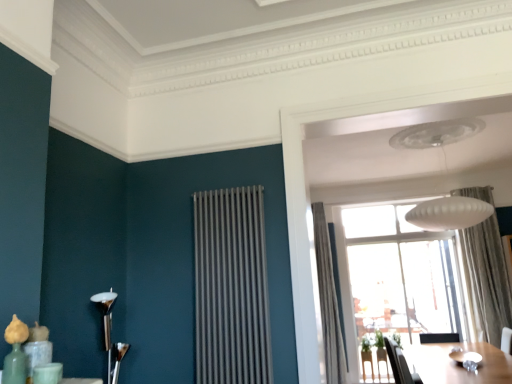
Question: Is polished silver candlestick at left, which ranks as the first lamp in front-to-back order, in front of or behind wooden table at lower right in the image?

Choices:
 (A) front
 (B) behind

Answer: (A)

Question: Does point (115, 372) appear closer or farther from the camera than point (489, 344)?

Choices:
 (A) farther
 (B) closer

Answer: (B)

Question: Which is farther from the transparent glass window at center?

Choices:
 (A) polished silver candlestick at left, marked as the 1th lamp in a left-to-right arrangement
 (B) black leather swivel chair at lower right
 (C) satin silver radiator at center
 (D) white textured curtain at upper right, the first curtain positioned from the right
 (E) white matte lampshade at upper center, the 1th lamp from the top

Answer: (A)

Question: Based on their relative distances, which object is nearer to the wooden table at lower right?

Choices:
 (A) transparent glass window at center
 (B) black leather swivel chair at lower right
 (C) gray textured curtain at upper right, positioned as the second curtain in right-to-left order
 (D) polished silver candlestick at left, which is the 2th lamp in top-to-bottom order
 (E) white textured curtain at upper right, arranged as the second curtain when viewed from the left

Answer: (B)